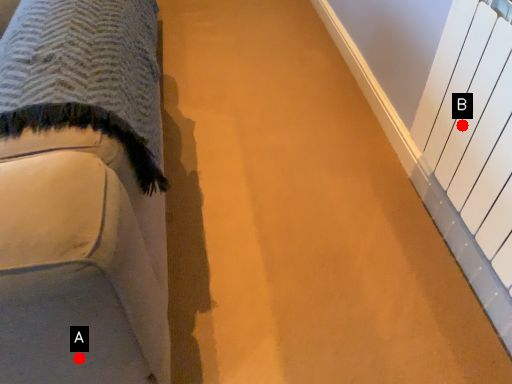
Question: Two points are circled on the image, labeled by A and B beside each circle. Which point is further to the camera?

Choices:
 (A) A is further
 (B) B is further

Answer: (B)